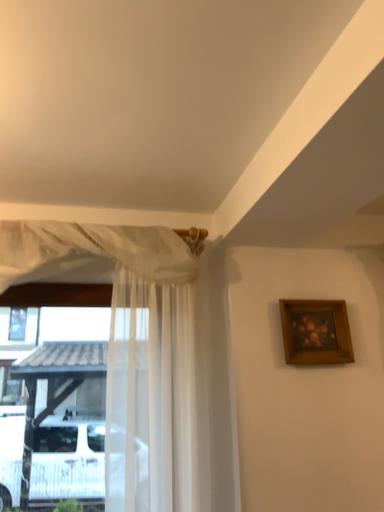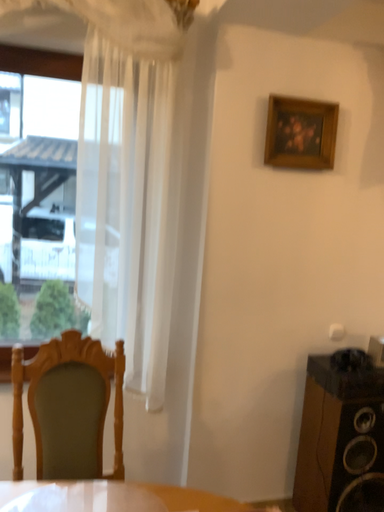
Question: Which way did the camera rotate in the video?

Choices:
 (A) rotated downward
 (B) rotated upward

Answer: (A)